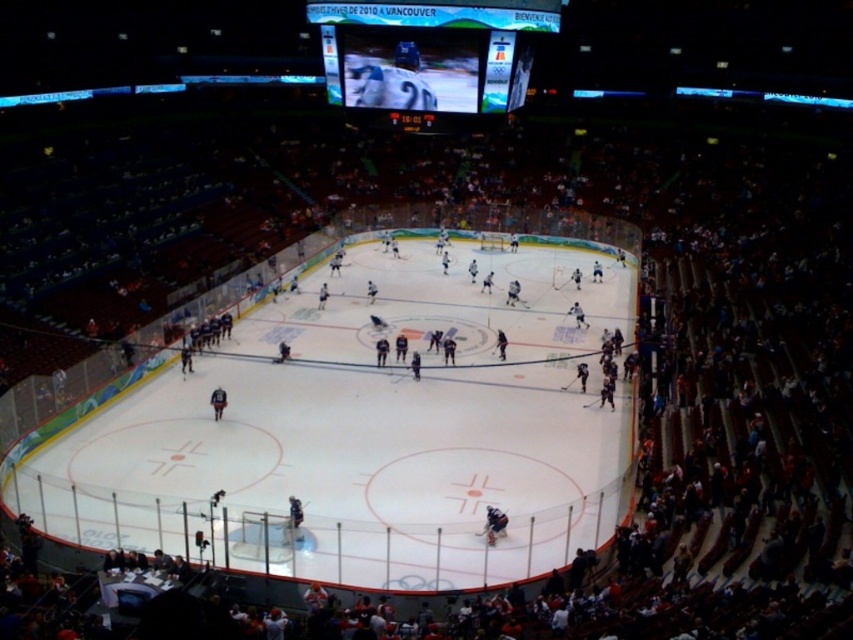
Does white smooth ice at center appear under white glossy scoreboard at upper center?

Correct, white smooth ice at center is located below white glossy scoreboard at upper center.

Is white smooth ice at center taller than white glossy scoreboard at upper center?

Yes.

Is point (236, 400) closer to camera compared to point (357, 48)?

No, it is behind (357, 48).

The height and width of the screenshot is (640, 853). Find the location of `white smooth ice at center`. white smooth ice at center is located at coordinates (338, 458).

Can you confirm if white smooth ice at center is positioned below dark blue jersey at center?

Actually, white smooth ice at center is above dark blue jersey at center.

Is white smooth ice at center taller than dark blue jersey at center?

Correct, white smooth ice at center is much taller as dark blue jersey at center.

This screenshot has width=853, height=640. I want to click on white smooth ice at center, so click(x=338, y=458).

This screenshot has width=853, height=640. I want to click on white smooth ice at center, so click(338, 458).

Does white glossy scoreboard at upper center appear over dark blue jersey at center?

Indeed, white glossy scoreboard at upper center is positioned over dark blue jersey at center.

Which is in front, point (328, 32) or point (500, 516)?

Point (500, 516) is in front.

Image resolution: width=853 pixels, height=640 pixels. Identify the location of white glossy scoreboard at upper center. (428, 52).